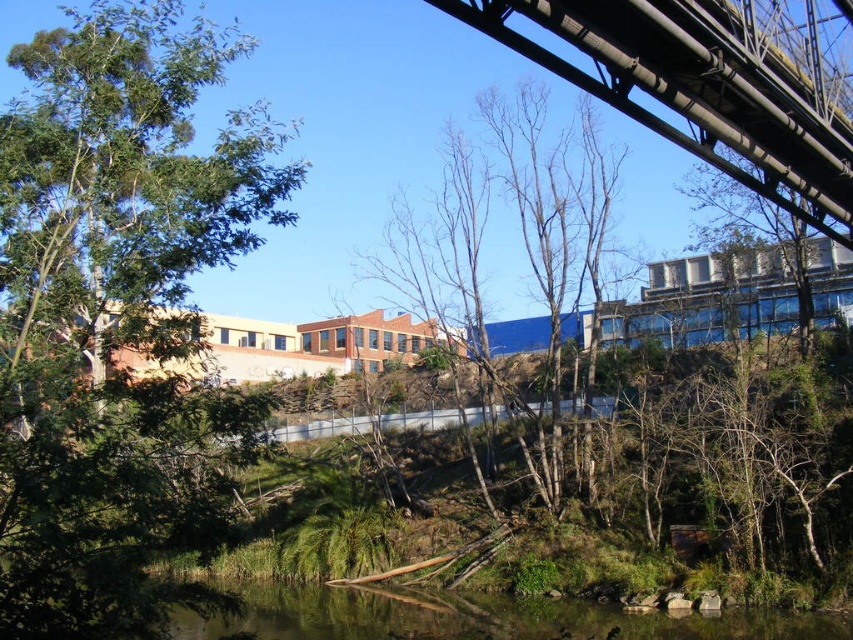
Is black metal bridge at upper right taller than bare branches at center?

No.

In the scene shown: Between black metal bridge at upper right and bare branches at center, which one appears on the right side from the viewer's perspective?

From the viewer's perspective, black metal bridge at upper right appears more on the right side.

This screenshot has height=640, width=853. I want to click on black metal bridge at upper right, so click(694, 90).

At what (x,y) coordinates should I click in order to perform the action: click on black metal bridge at upper right. Please return your answer as a coordinate pair (x, y). Looking at the image, I should click on (694, 90).

Can you confirm if green leafy tree at upper left is thinner than clear water at lower center?

In fact, green leafy tree at upper left might be wider than clear water at lower center.

Is green leafy tree at upper left wider than clear water at lower center?

Yes.

Is point (183, 401) closer to viewer compared to point (198, 621)?

Yes, point (183, 401) is closer to viewer.

Identify the location of green leafy tree at upper left. (115, 310).

Between point (795, 136) and point (413, 609), which one is positioned behind?

The point (413, 609) is behind.

This screenshot has height=640, width=853. Describe the element at coordinates (694, 90) in the screenshot. I see `black metal bridge at upper right` at that location.

You are a GUI agent. You are given a task and a screenshot of the screen. Output one action in this format:
    pyautogui.click(x=<x>, y=<y>)
    Task: Click on the black metal bridge at upper right
    The image size is (853, 640).
    Given the screenshot: What is the action you would take?
    pyautogui.click(x=694, y=90)